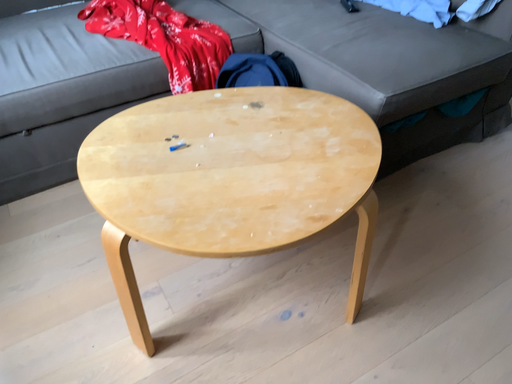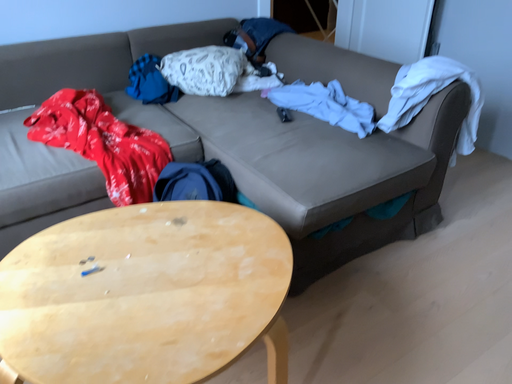
Question: Which way did the camera rotate in the video?

Choices:
 (A) rotated downward
 (B) rotated upward

Answer: (B)